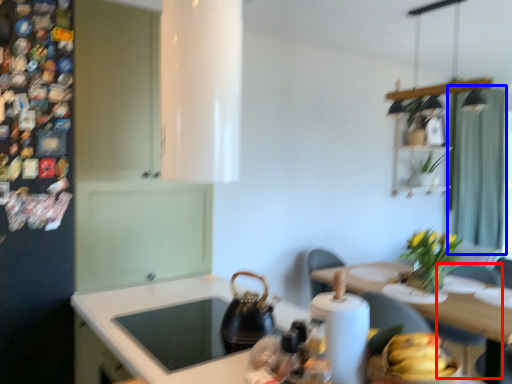
Question: Which object appears farthest to the camera in this image, chair (highlighted by a red box) or curtain (highlighted by a blue box)?

Choices:
 (A) chair
 (B) curtain

Answer: (B)